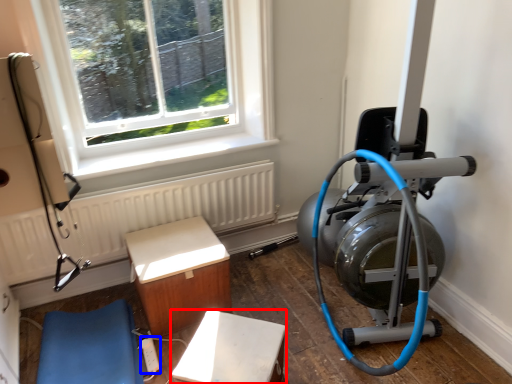
Question: Which object appears farthest to the camera in this image, furniture (highlighted by a red box) or extension cord (highlighted by a blue box)?

Choices:
 (A) furniture
 (B) extension cord

Answer: (B)